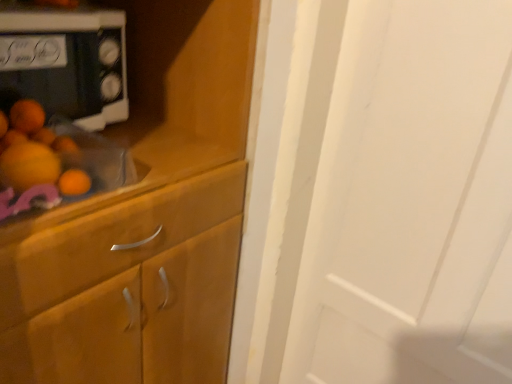
Question: Is white glossy microwave at upper left facing towards wooden cabinet at left?

Choices:
 (A) no
 (B) yes

Answer: (A)

Question: Could wooden cabinet at left be considered to be inside white glossy microwave at upper left?

Choices:
 (A) yes
 (B) no

Answer: (B)

Question: Can you confirm if white glossy microwave at upper left is positioned to the right of wooden cabinet at left?

Choices:
 (A) yes
 (B) no

Answer: (A)

Question: Is white glossy microwave at upper left at the left side of wooden cabinet at left?

Choices:
 (A) yes
 (B) no

Answer: (B)

Question: Considering the relative sizes of white glossy microwave at upper left and wooden cabinet at left in the image provided, is white glossy microwave at upper left smaller than wooden cabinet at left?

Choices:
 (A) yes
 (B) no

Answer: (A)

Question: From the image's perspective, is white glossy microwave at upper left located above wooden cabinet at left?

Choices:
 (A) yes
 (B) no

Answer: (A)

Question: From a real-world perspective, is wooden cabinet at left positioned over white glossy microwave at upper left based on gravity?

Choices:
 (A) no
 (B) yes

Answer: (A)

Question: Is wooden cabinet at left oriented away from white glossy microwave at upper left?

Choices:
 (A) yes
 (B) no

Answer: (B)

Question: From a real-world perspective, is wooden cabinet at left beneath white glossy microwave at upper left?

Choices:
 (A) no
 (B) yes

Answer: (B)

Question: Are wooden cabinet at left and white glossy microwave at upper left making contact?

Choices:
 (A) no
 (B) yes

Answer: (A)

Question: Is wooden cabinet at left thinner than white glossy microwave at upper left?

Choices:
 (A) yes
 (B) no

Answer: (B)

Question: Does wooden cabinet at left come behind white glossy microwave at upper left?

Choices:
 (A) no
 (B) yes

Answer: (A)

Question: From a real-world perspective, is wooden cabinet at left physically located above or below white glossy microwave at upper left?

Choices:
 (A) above
 (B) below

Answer: (B)